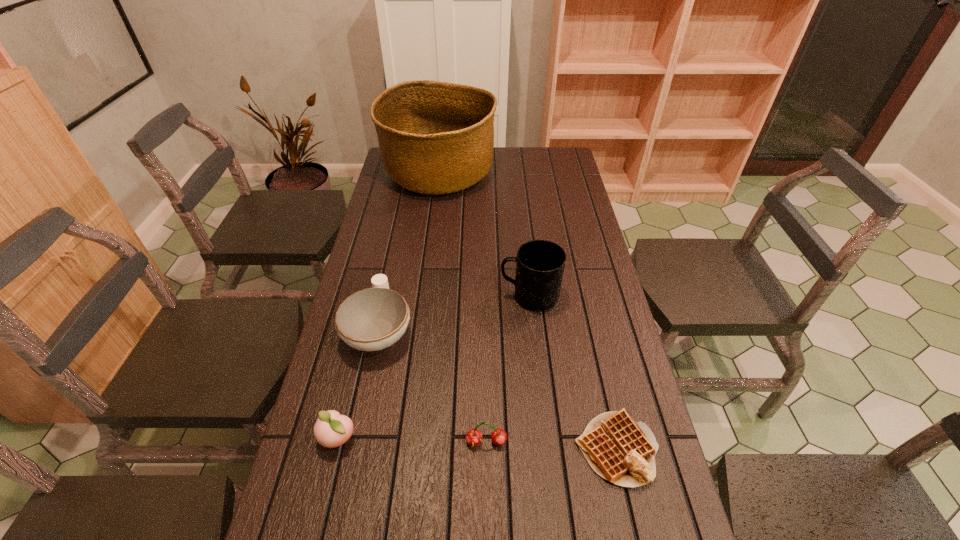
Locate an element on the screen. This screenshot has height=540, width=960. vacant space that's between the cherry and the basket is located at coordinates (463, 308).

The image size is (960, 540). What are the coordinates of `empty location between the cherry and the chinaware` in the screenshot? It's located at (433, 386).

I want to click on free space between the cherry and the shortest object, so click(551, 446).

Identify the location of free space between the cherry and the fifth shortest object. (508, 369).

The height and width of the screenshot is (540, 960). I want to click on vacant point located between the chinaware and the second tallest object, so click(454, 313).

Where is `vacant area between the tallest object and the mug`? vacant area between the tallest object and the mug is located at coordinates (485, 235).

This screenshot has width=960, height=540. I want to click on free spot between the cherry and the chinaware, so click(433, 386).

Locate an element on the screen. The height and width of the screenshot is (540, 960). the fourth closest object to the chinaware is located at coordinates (620, 450).

Locate an element on the screen. The height and width of the screenshot is (540, 960). the third closest object relative to the peach is located at coordinates pos(540,264).

The width and height of the screenshot is (960, 540). I want to click on free space that satisfies the following two spatial constraints: 1. on the side of the shortest object with the handle; 2. on the left side of the fifth shortest object, so click(546, 449).